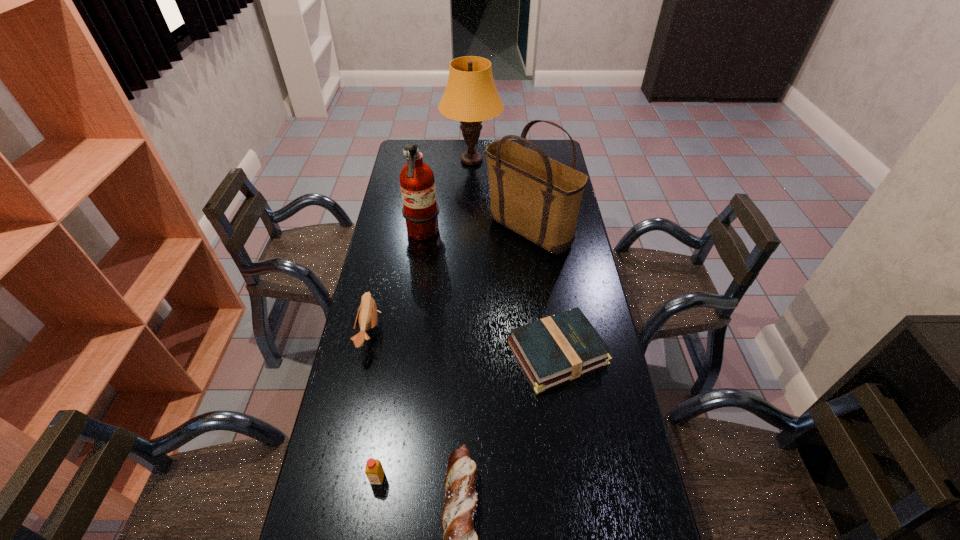
Find the location of a particular element. The image size is (960, 540). free location located 0.060m on the back of the hardback book is located at coordinates (550, 303).

At what (x,y) coordinates should I click in order to perform the action: click on object located in the far edge section of the desktop. Please return your answer as a coordinate pair (x, y). This screenshot has width=960, height=540. Looking at the image, I should click on (470, 97).

The image size is (960, 540). I want to click on fire extinguisher located in the left edge section of the desktop, so click(420, 210).

The height and width of the screenshot is (540, 960). I want to click on bird present at the left edge, so click(x=367, y=316).

What are the coordinates of `orange juice that is at the left edge` in the screenshot? It's located at (374, 470).

The image size is (960, 540). In order to click on tote bag that is at the right edge in this screenshot , I will do `click(537, 197)`.

This screenshot has height=540, width=960. What are the coordinates of `hardback book located in the right edge section of the desktop` in the screenshot? It's located at (556, 349).

This screenshot has width=960, height=540. Find the location of `free location at the far edge of the desktop`. free location at the far edge of the desktop is located at coordinates (437, 145).

Locate an element on the screen. vacant space at the left edge of the desktop is located at coordinates (337, 496).

Locate an element on the screen. The image size is (960, 540). vacant region at the right edge is located at coordinates (553, 285).